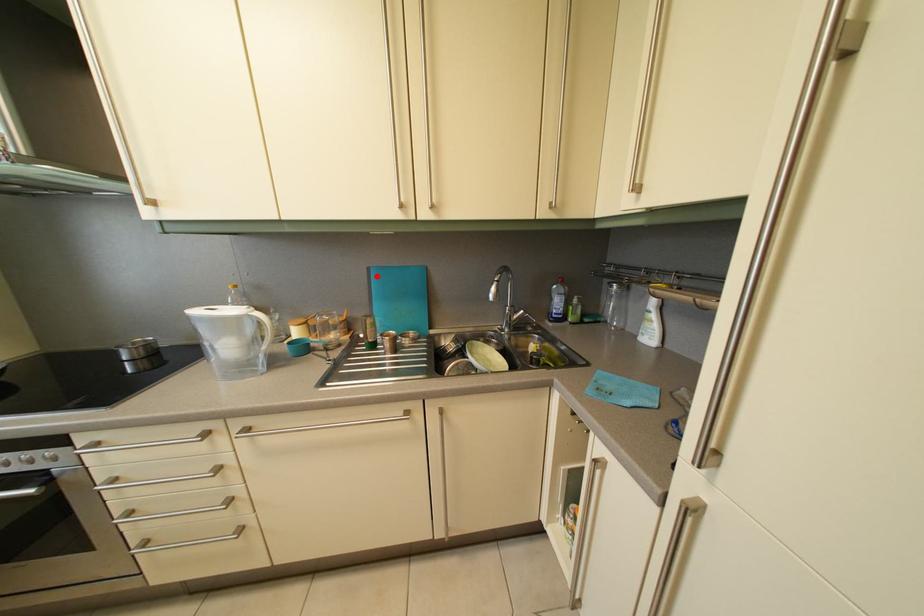
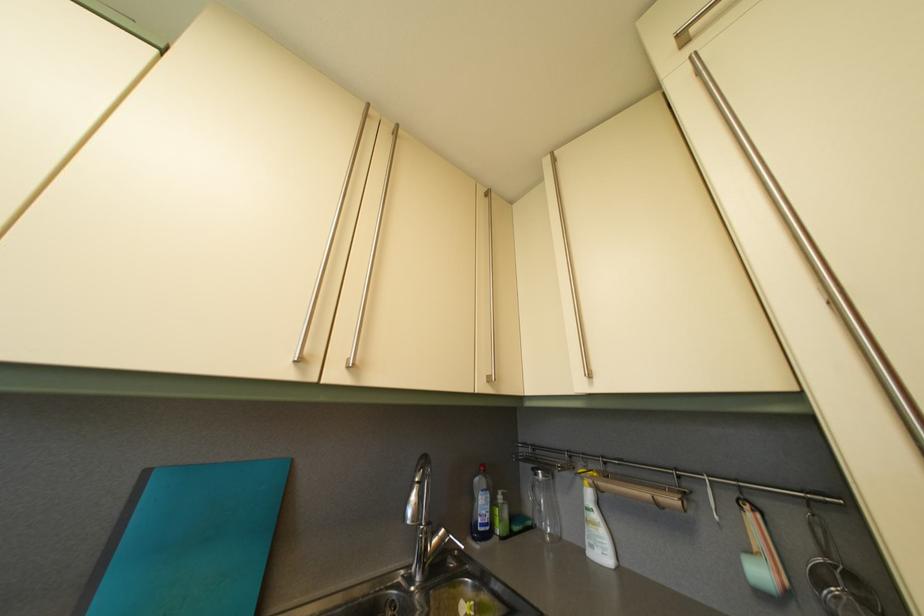
Where in the second image is the point corresponding to the highlighted location from the first image?

(154, 480)